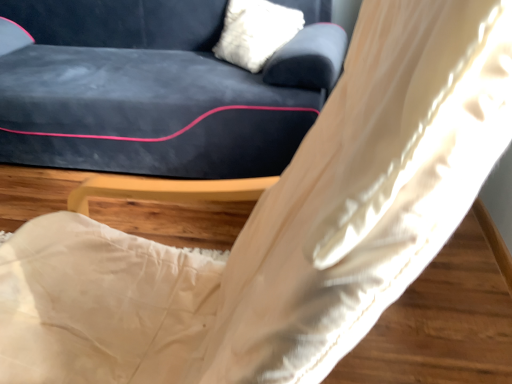
What do you see at coordinates (256, 32) in the screenshot?
I see `white soft pillow at upper center` at bounding box center [256, 32].

Locate an element on the screen. This screenshot has width=512, height=384. white soft pillow at upper center is located at coordinates coord(256,32).

Where is `white soft pillow at upper center`? This screenshot has width=512, height=384. white soft pillow at upper center is located at coordinates (256, 32).